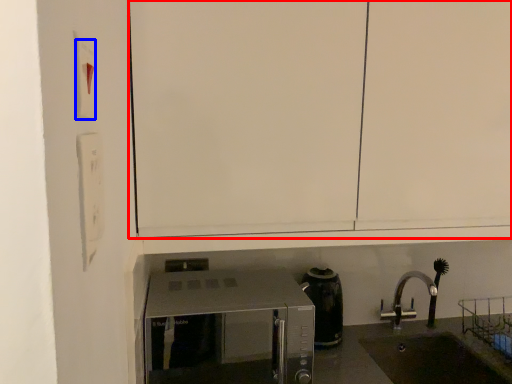
Question: Which object appears farthest to the camera in this image, cabinetry (highlighted by a red box) or light switch (highlighted by a blue box)?

Choices:
 (A) cabinetry
 (B) light switch

Answer: (A)